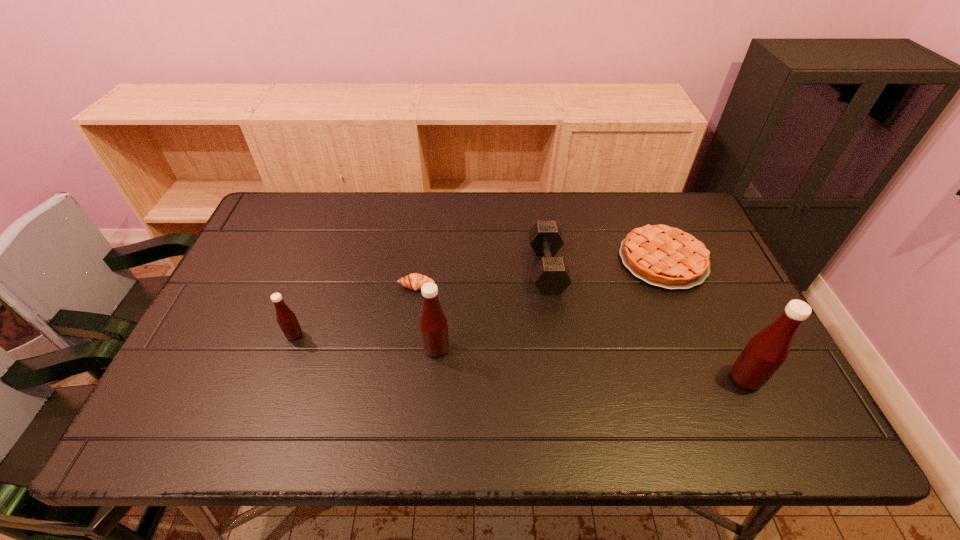
You are a GUI agent. You are given a task and a screenshot of the screen. Output one action in this format:
    pyautogui.click(x=<x>, y=<y>)
    Task: Click on the object present at the far right corner
    The width and height of the screenshot is (960, 540).
    Given the screenshot: What is the action you would take?
    pyautogui.click(x=663, y=256)

This screenshot has height=540, width=960. Identify the location of object situated at the near right corner. (766, 351).

This screenshot has width=960, height=540. Find the location of `vacant space at the far edge of the desktop`. vacant space at the far edge of the desktop is located at coordinates (311, 234).

I want to click on vacant region at the near edge of the desktop, so click(x=534, y=386).

In the image, there is a desktop. Identify the location of free space at the left edge. (281, 271).

Locate an element on the screen. The image size is (960, 540). vacant space at the right edge is located at coordinates (716, 271).

This screenshot has height=540, width=960. I want to click on free space at the far left corner, so click(297, 231).

In the image, there is a desktop. What are the coordinates of `free space at the far right corner` in the screenshot? It's located at (660, 213).

Identify the location of vacant area between the pastry and the shortest Tabasco sauce. This screenshot has height=540, width=960. (355, 310).

Identify the location of vacant area that lies between the leftmost object and the second Tabasco sauce from right to left. (366, 342).